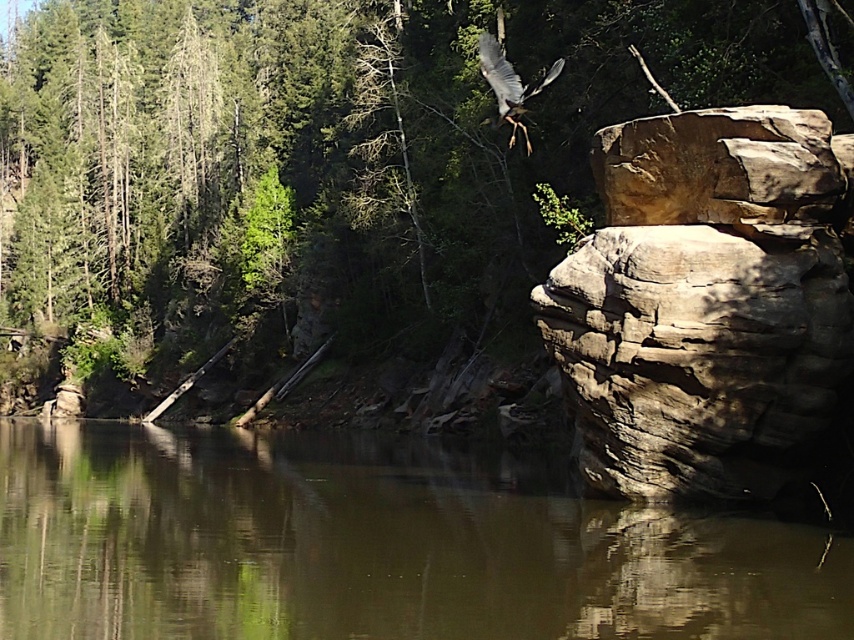
You are an ornithologist observing the gray feathered bird at upper center and the brown rough rock at right. Which object is taller in the image?

The gray feathered bird at upper center is taller than the brown rough rock at right.

From the picture: You are an observer standing at the water edge in the scene. You notice both the green leafy tree at upper center and the gray feathered bird at upper center. Which object is nearer to you?

The green leafy tree at upper center is closer to the viewer than the gray feathered bird at upper center.